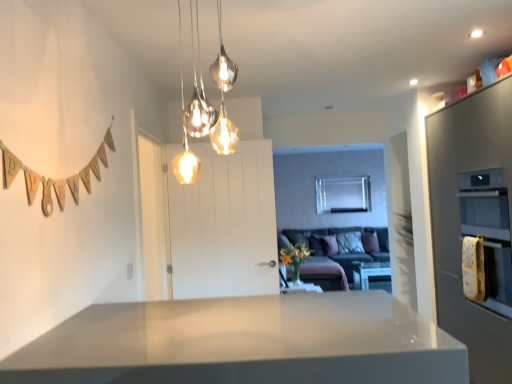
Question: Does velvet grey couch at center have a smaller size compared to satin grey oven at right?

Choices:
 (A) no
 (B) yes

Answer: (A)

Question: From a real-world perspective, is velvet grey couch at center physically above satin grey oven at right?

Choices:
 (A) yes
 (B) no

Answer: (B)

Question: Can we say velvet grey couch at center lies outside satin grey oven at right?

Choices:
 (A) yes
 (B) no

Answer: (A)

Question: Is velvet grey couch at center aimed at satin grey oven at right?

Choices:
 (A) yes
 (B) no

Answer: (A)

Question: Would you consider velvet grey couch at center to be distant from satin grey oven at right?

Choices:
 (A) yes
 (B) no

Answer: (A)

Question: From the image's perspective, is white wooden door at center above or below white glossy table at center?

Choices:
 (A) below
 (B) above

Answer: (B)

Question: From a real-world perspective, is white wooden door at center physically located above or below white glossy table at center?

Choices:
 (A) above
 (B) below

Answer: (A)

Question: In terms of width, does white wooden door at center look wider or thinner when compared to white glossy table at center?

Choices:
 (A) wide
 (B) thin

Answer: (B)

Question: Considering their positions, is white wooden door at center located in front of or behind white glossy table at center?

Choices:
 (A) behind
 (B) front

Answer: (B)

Question: Considering their positions, is velvet grey couch at center located in front of or behind metallic glass pendant lights at upper center?

Choices:
 (A) front
 (B) behind

Answer: (B)

Question: From a real-world perspective, is velvet grey couch at center positioned above or below metallic glass pendant lights at upper center?

Choices:
 (A) below
 (B) above

Answer: (A)

Question: In terms of width, does velvet grey couch at center look wider or thinner when compared to metallic glass pendant lights at upper center?

Choices:
 (A) thin
 (B) wide

Answer: (B)

Question: From the image's perspective, is velvet grey couch at center located above or below metallic glass pendant lights at upper center?

Choices:
 (A) above
 (B) below

Answer: (B)

Question: Looking at the image, does satin grey oven at right seem bigger or smaller compared to white wooden door at center?

Choices:
 (A) big
 (B) small

Answer: (A)

Question: Considering their positions, is satin grey oven at right located in front of or behind white wooden door at center?

Choices:
 (A) behind
 (B) front

Answer: (B)